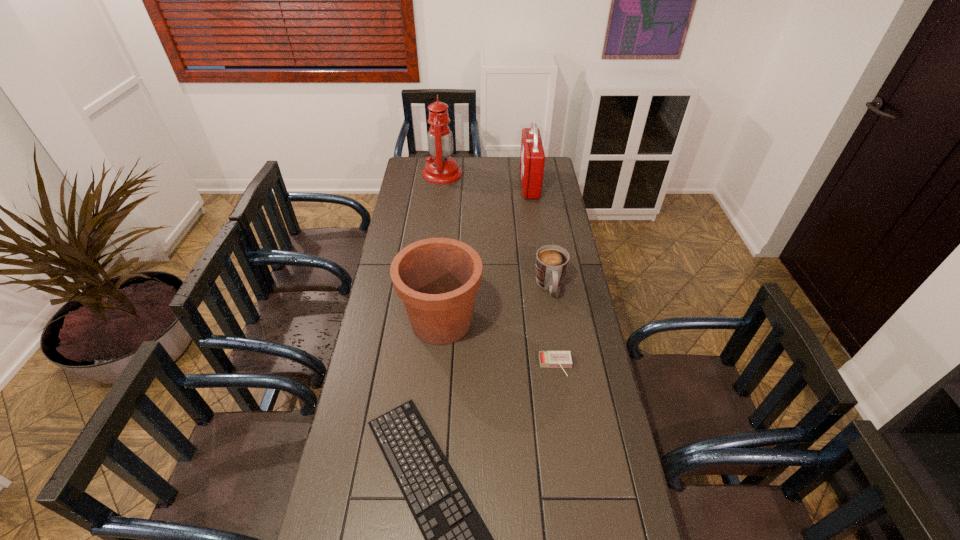
You are a GUI agent. You are given a task and a screenshot of the screen. Output one action in this format:
    pyautogui.click(x=<x>, y=<y>)
    Task: Click on the free area in between the first-aid kit and the mug
    This screenshot has height=540, width=960.
    Given the screenshot: What is the action you would take?
    pyautogui.click(x=540, y=235)

Where is `vacant area that lies between the third tallest object and the fourth tallest object`? Image resolution: width=960 pixels, height=540 pixels. vacant area that lies between the third tallest object and the fourth tallest object is located at coordinates (495, 303).

You are a GUI agent. You are given a task and a screenshot of the screen. Output one action in this format:
    pyautogui.click(x=<x>, y=<y>)
    Task: Click on the free spot between the fifth shortest object and the flowerpot
    
    Given the screenshot: What is the action you would take?
    pyautogui.click(x=486, y=253)

Select which object is the fourth closest to the computer keyboard. Please provide its 2D coordinates. Your answer should be formatted as a tuple, i.e. [(x, y)], where the tuple contains the x and y coordinates of a point satisfying the conditions above.

[(532, 158)]

Find the location of a particular element. This screenshot has width=960, height=540. the second closest object to the second shortest object is located at coordinates (437, 279).

Locate an element on the screen. free space in the image that satisfies the following two spatial constraints: 1. on the front face of the second tallest object; 2. on the striking surface of the second shortest object is located at coordinates (557, 366).

Identify the location of blank space that satisfies the following two spatial constraints: 1. on the front face of the first-aid kit; 2. on the striking surface of the matchbox. (557, 366).